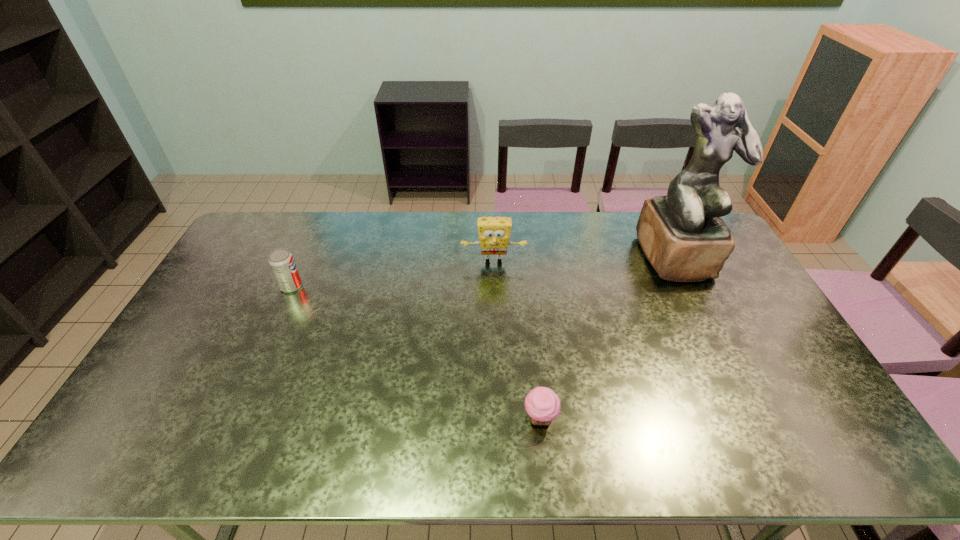
This screenshot has height=540, width=960. I want to click on free region at the near right corner, so click(x=821, y=465).

You are a GUI agent. You are given a task and a screenshot of the screen. Output one action in this format:
    pyautogui.click(x=<x>, y=<y>)
    Task: Click on the free point between the third shortest object and the nearest object
    
    Given the screenshot: What is the action you would take?
    pyautogui.click(x=517, y=340)

In order to click on blank region between the rightmost object and the sponge in this screenshot , I will do `click(586, 260)`.

This screenshot has height=540, width=960. I want to click on free area in between the leftmost object and the shortest object, so click(416, 352).

The width and height of the screenshot is (960, 540). I want to click on free space between the cupcake and the sculpture, so click(x=609, y=338).

This screenshot has height=540, width=960. Identify the location of vacant area that lies between the third tallest object and the cupcake. (416, 352).

Locate an element on the screen. unoccupied area between the sculpture and the second tallest object is located at coordinates (586, 260).

You are a GUI agent. You are given a task and a screenshot of the screen. Output one action in this format:
    pyautogui.click(x=<x>, y=<y>)
    Task: Click on the unoccupied area between the second tallest object and the leftmost object
    
    Given the screenshot: What is the action you would take?
    pyautogui.click(x=393, y=274)

This screenshot has width=960, height=540. What are the coordinates of `unoccupied position between the leftmost object and the sculpture` in the screenshot? It's located at (484, 272).

At what (x,y) coordinates should I click in order to perform the action: click on unoccupied area between the rightmost object and the nearest object. Please return your answer as a coordinate pair (x, y). Looking at the image, I should click on (609, 338).